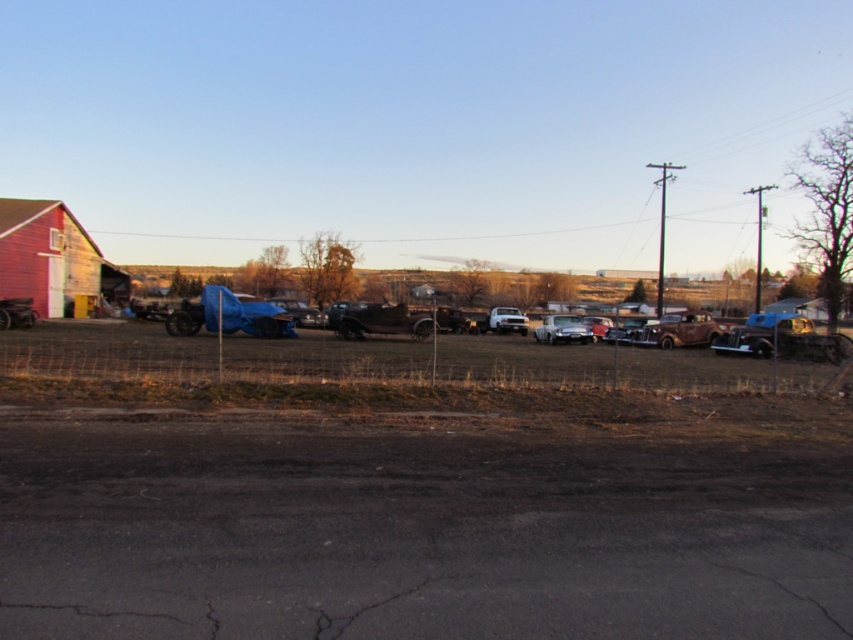
Question: Does black asphalt at lower center appear on the right side of glossy silver car at center?

Choices:
 (A) yes
 (B) no

Answer: (B)

Question: Which of these objects is positioned closest to the red wooden barn at left?

Choices:
 (A) metallic silver truck at center
 (B) glossy silver car at center
 (C) black asphalt at lower center

Answer: (A)

Question: Among these objects, which one is nearest to the camera?

Choices:
 (A) metallic silver truck at center
 (B) red wooden barn at left
 (C) black asphalt at lower center
 (D) glossy silver car at center

Answer: (C)

Question: Can you confirm if glossy silver car at center is positioned to the left of metallic silver truck at center?

Choices:
 (A) no
 (B) yes

Answer: (A)

Question: Which object is the farthest from the red wooden barn at left?

Choices:
 (A) metallic silver truck at center
 (B) black asphalt at lower center

Answer: (B)

Question: Where is black asphalt at lower center located in relation to glossy silver car at center in the image?

Choices:
 (A) right
 (B) left

Answer: (B)